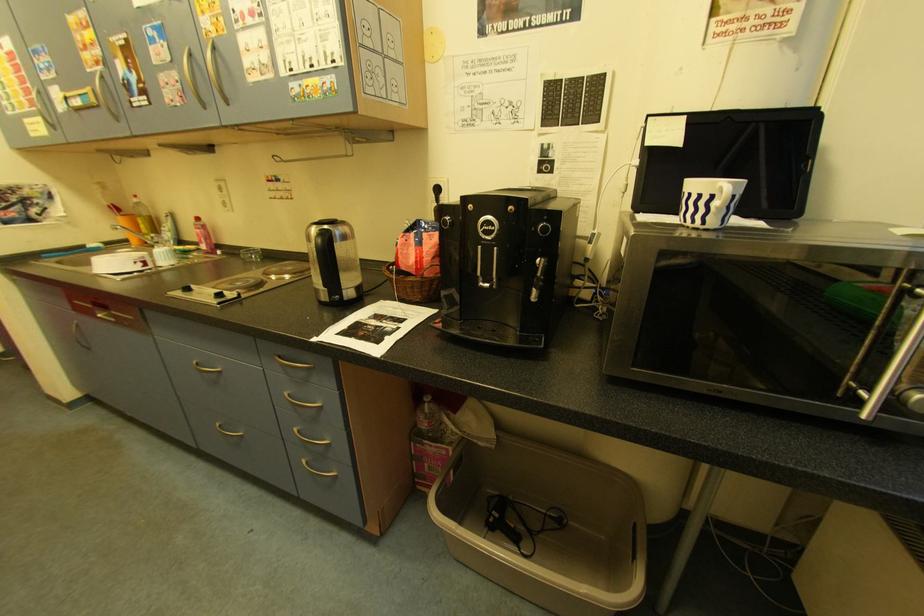
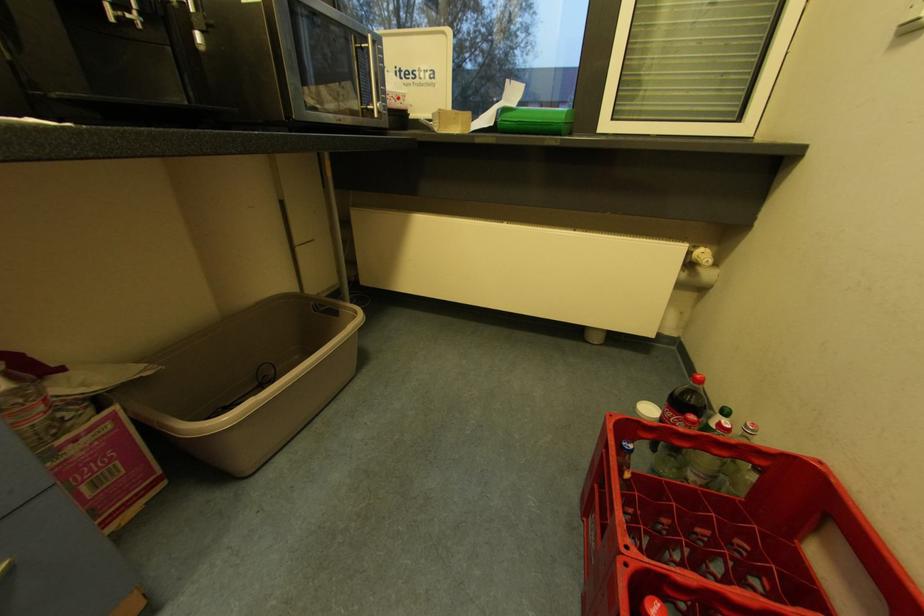
How did the camera likely rotate?

The camera's rotation is toward right-down.